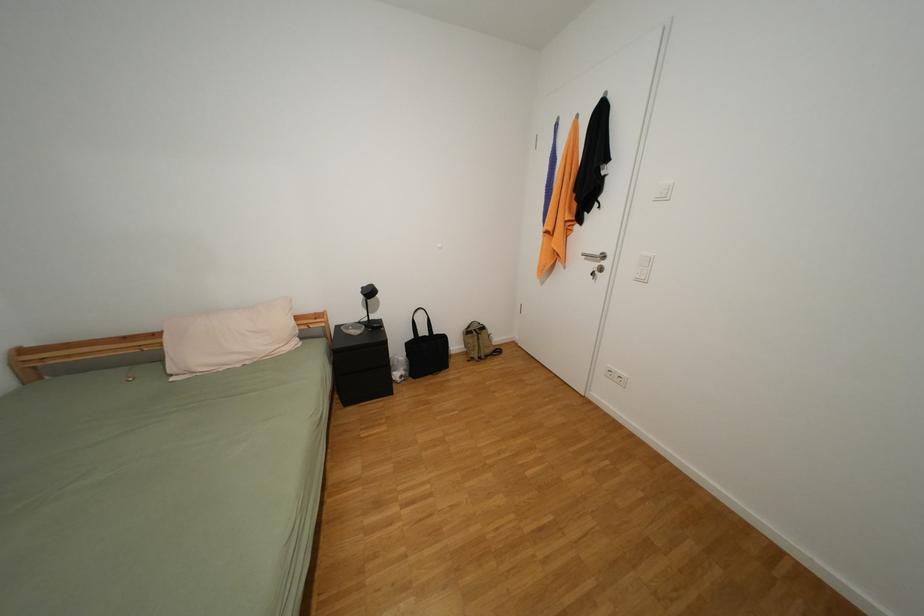
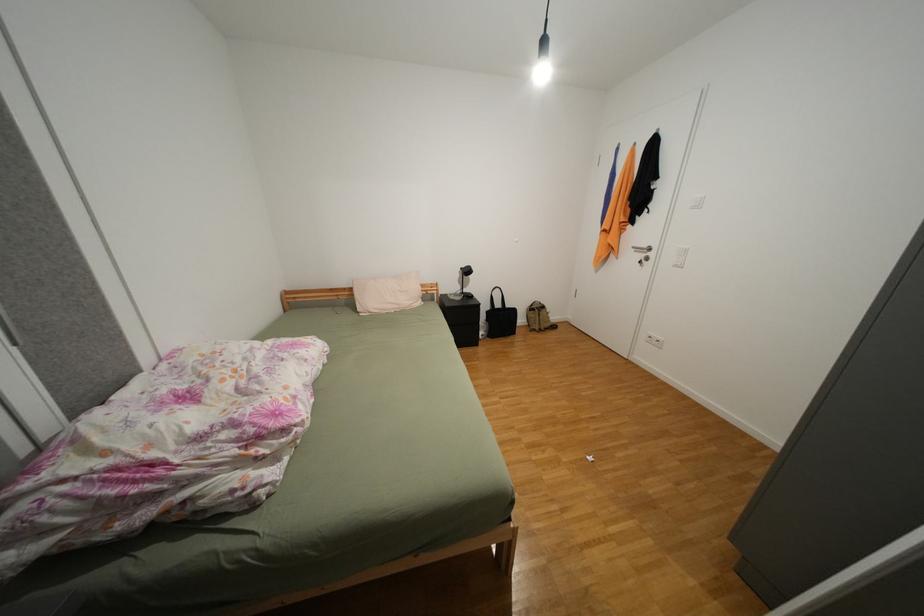
Question: The camera is either moving clockwise (left) or counter-clockwise (right) around the object. The first image is from the beginning of the video and the second image is from the end. Is the camera moving left or right when shooting the video?

Choices:
 (A) Left
 (B) Right

Answer: (B)